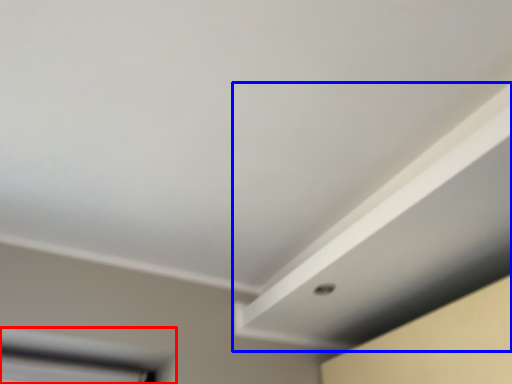
Question: Which point is closer to the camera, window (highlighted by a red box) or exhaust hood (highlighted by a blue box)?

Choices:
 (A) window
 (B) exhaust hood

Answer: (B)